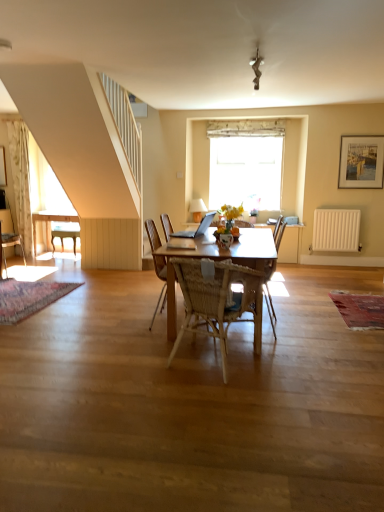
Image resolution: width=384 pixels, height=512 pixels. In order to click on free space in front of woven wood chair at center, acting as the third chair starting from the left in this screenshot , I will do `click(236, 398)`.